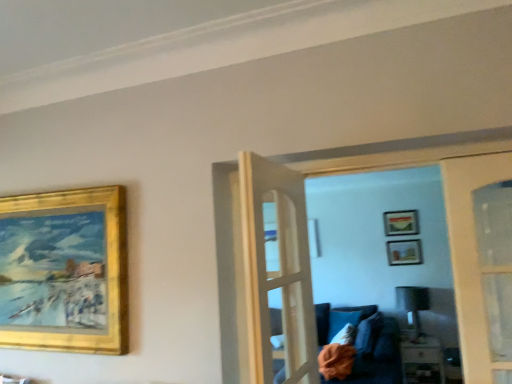
Question: Does matte gold picture frame at upper center, which ranks as the second picture frame in back-to-front order, come in front of white fabric pillow at lower center?

Choices:
 (A) yes
 (B) no

Answer: (B)

Question: From the image's perspective, is matte gold picture frame at upper center, acting as the 1th picture frame starting from the right, over white fabric pillow at lower center?

Choices:
 (A) no
 (B) yes

Answer: (B)

Question: Is matte gold picture frame at upper center, which ranks as the second picture frame in back-to-front order, further to the viewer compared to white fabric pillow at lower center?

Choices:
 (A) no
 (B) yes

Answer: (B)

Question: From the image's perspective, is matte gold picture frame at upper center, the second picture frame in the front-to-back sequence, below white fabric pillow at lower center?

Choices:
 (A) no
 (B) yes

Answer: (A)

Question: Is matte gold picture frame at upper center, the second picture frame in the front-to-back sequence, positioned with its back to white fabric pillow at lower center?

Choices:
 (A) no
 (B) yes

Answer: (A)

Question: Is matte gold picture frame at upper center, which ranks as the second picture frame in back-to-front order, to the right of white fabric pillow at lower center from the viewer's perspective?

Choices:
 (A) no
 (B) yes

Answer: (B)

Question: From the image's perspective, is white fabric pillow at lower center under matte gold picture frame at upper center, which ranks as the second picture frame in back-to-front order?

Choices:
 (A) no
 (B) yes

Answer: (B)

Question: From a real-world perspective, does white fabric pillow at lower center sit lower than matte gold picture frame at upper center, the third picture frame viewed from the left?

Choices:
 (A) yes
 (B) no

Answer: (A)

Question: Is white fabric pillow at lower center taller than matte gold picture frame at upper center, acting as the 1th picture frame starting from the right?

Choices:
 (A) yes
 (B) no

Answer: (A)

Question: Can you confirm if white fabric pillow at lower center is smaller than matte gold picture frame at upper center, the third picture frame viewed from the left?

Choices:
 (A) no
 (B) yes

Answer: (A)

Question: Considering the relative sizes of white fabric pillow at lower center and matte gold picture frame at upper center, the third picture frame viewed from the left, in the image provided, is white fabric pillow at lower center thinner than matte gold picture frame at upper center, the third picture frame viewed from the left,?

Choices:
 (A) no
 (B) yes

Answer: (A)

Question: Is white fabric pillow at lower center positioned far away from matte gold picture frame at upper center, acting as the 1th picture frame starting from the right?

Choices:
 (A) yes
 (B) no

Answer: (A)

Question: Is there a large distance between gold/gilded picture frame at upper left, the third picture frame in the right-to-left sequence, and matte gold picture frame at upper center, the third picture frame viewed from the left?

Choices:
 (A) yes
 (B) no

Answer: (A)